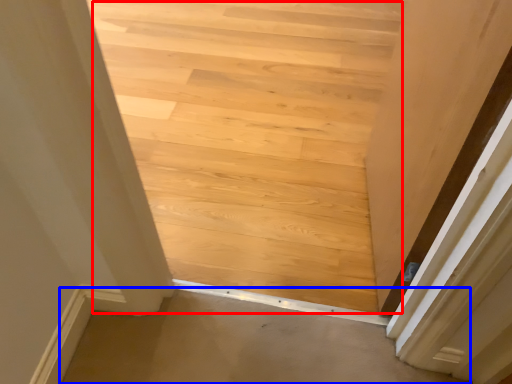
Question: Which object is further to the camera taking this photo, stairwell (highlighted by a red box) or plain (highlighted by a blue box)?

Choices:
 (A) stairwell
 (B) plain

Answer: (A)